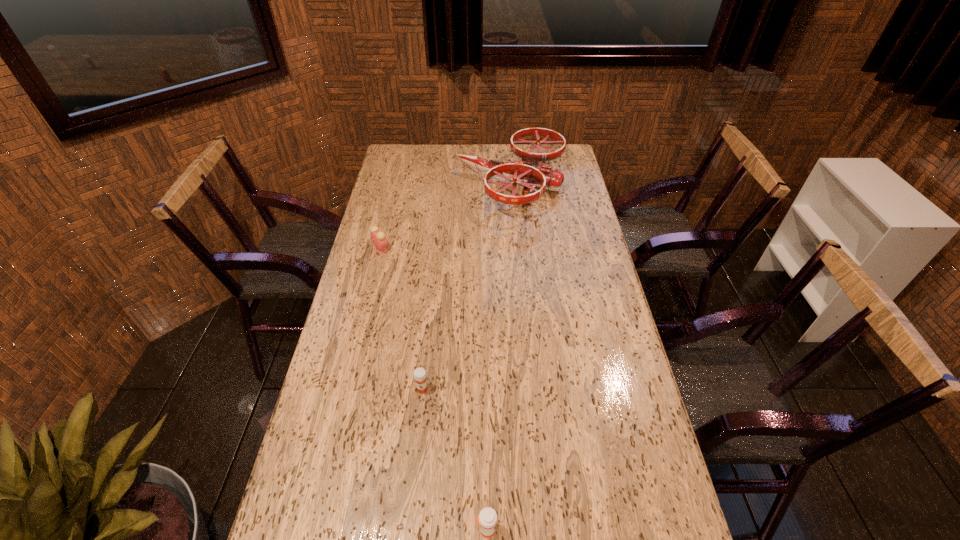
Identify the location of the tallest object. (528, 173).

Find the location of a particular element. Image resolution: width=960 pixels, height=540 pixels. the farthest object is located at coordinates tap(528, 173).

At what (x,y) coordinates should I click in order to perform the action: click on the leftmost object. Please return your answer as a coordinate pair (x, y). Looking at the image, I should click on (x=378, y=238).

The height and width of the screenshot is (540, 960). I want to click on alarm clock, so click(x=378, y=238).

In order to click on the nearest object in this screenshot , I will do `click(487, 519)`.

Where is `the nearer medicine`? This screenshot has height=540, width=960. the nearer medicine is located at coordinates (487, 519).

Identify the location of the left medicine. (419, 373).

Where is `the second nearest object`? The width and height of the screenshot is (960, 540). the second nearest object is located at coordinates (419, 373).

Where is `vacant space located 0.280m on the left of the farthest object`? vacant space located 0.280m on the left of the farthest object is located at coordinates (393, 185).

Find the location of a particular element. The height and width of the screenshot is (540, 960). vacant space situated 0.300m on the face of the alarm clock is located at coordinates [470, 248].